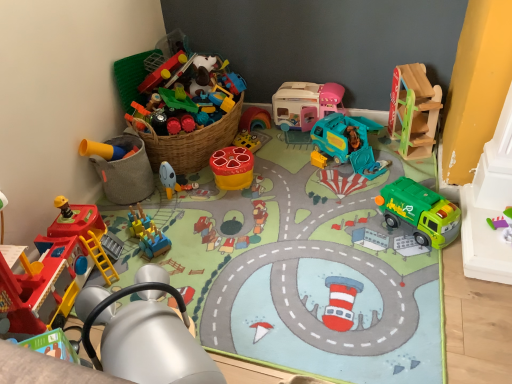
At what (x,y) coordinates should I click in order to perform the action: click on free space to the left of matte plastic stool at center, the 5th toy from the right. Please return your answer as a coordinate pair (x, y). Looking at the image, I should click on (197, 182).